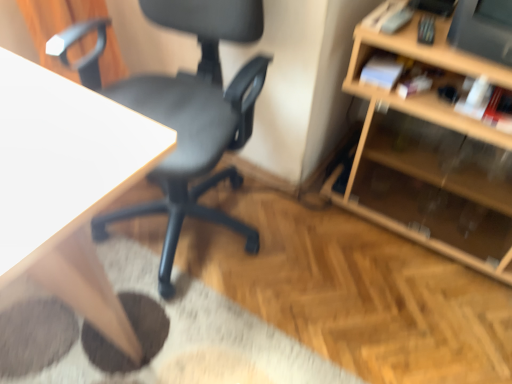
This screenshot has width=512, height=384. I want to click on vacant space underneath black plastic chair at center (from a real-world perspective), so click(197, 225).